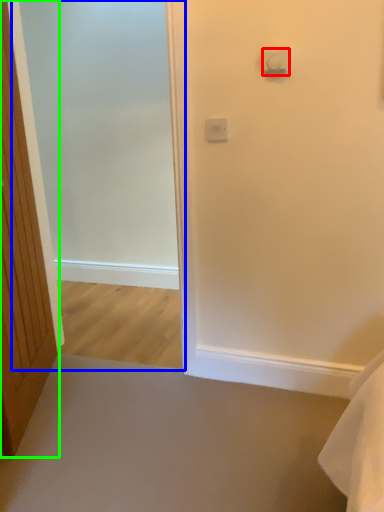
Question: Which object is the farthest from light switch (highlighted by a red box)? Choose among these: screen door (highlighted by a blue box) or door (highlighted by a green box).

Choices:
 (A) screen door
 (B) door

Answer: (A)